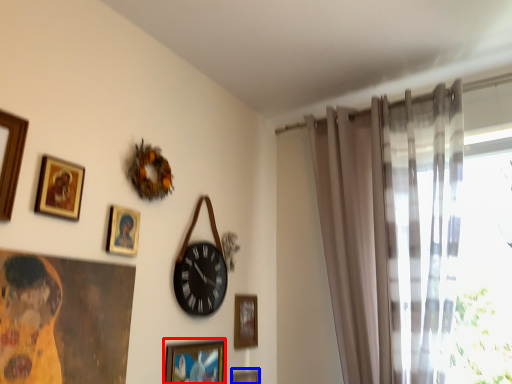
Question: Which object appears closest to the camera in this image, picture frame (highlighted by a red box) or picture frame (highlighted by a blue box)?

Choices:
 (A) picture frame
 (B) picture frame

Answer: (A)